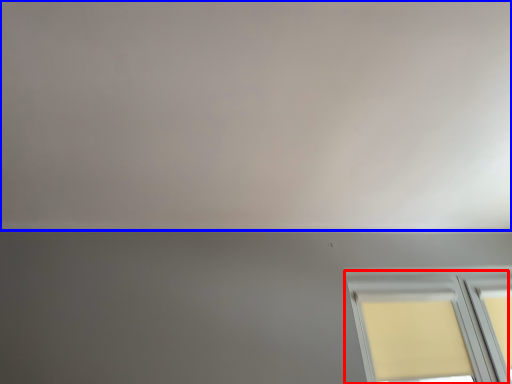
Question: Among these objects, which one is farthest to the camera, window (highlighted by a red box) or backdrop (highlighted by a blue box)?

Choices:
 (A) window
 (B) backdrop

Answer: (A)